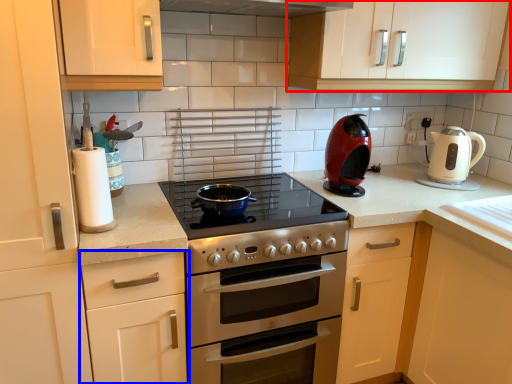
Question: Among these objects, which one is nearest to the camera, cabinetry (highlighted by a red box) or cabinetry (highlighted by a blue box)?

Choices:
 (A) cabinetry
 (B) cabinetry

Answer: (B)